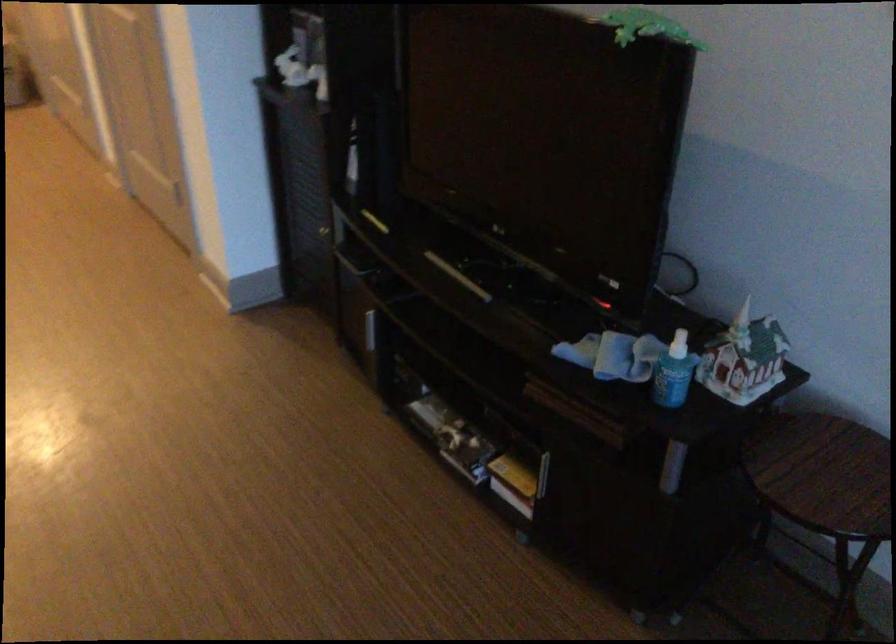
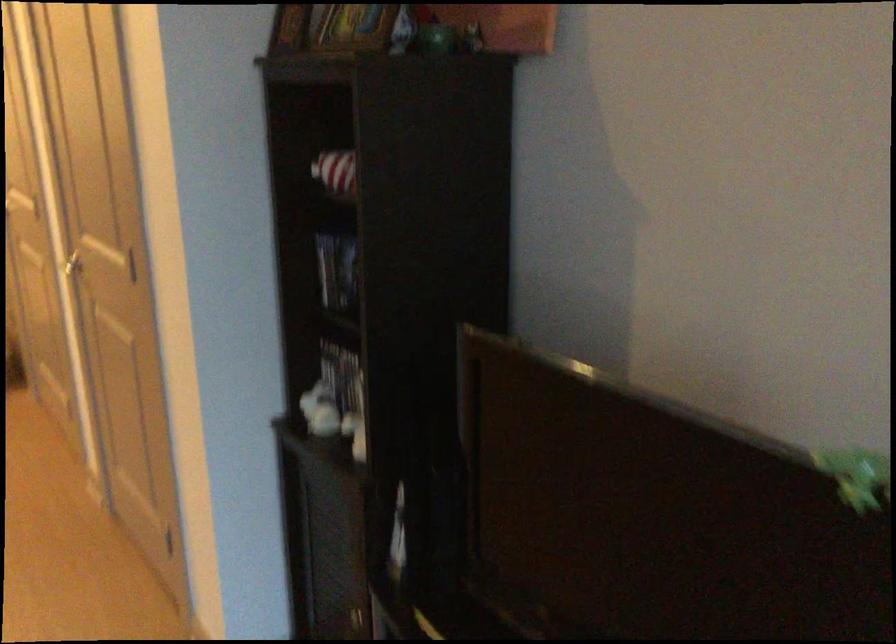
Find the pixel in the second image that matches point (302, 76) in the first image.

(332, 418)